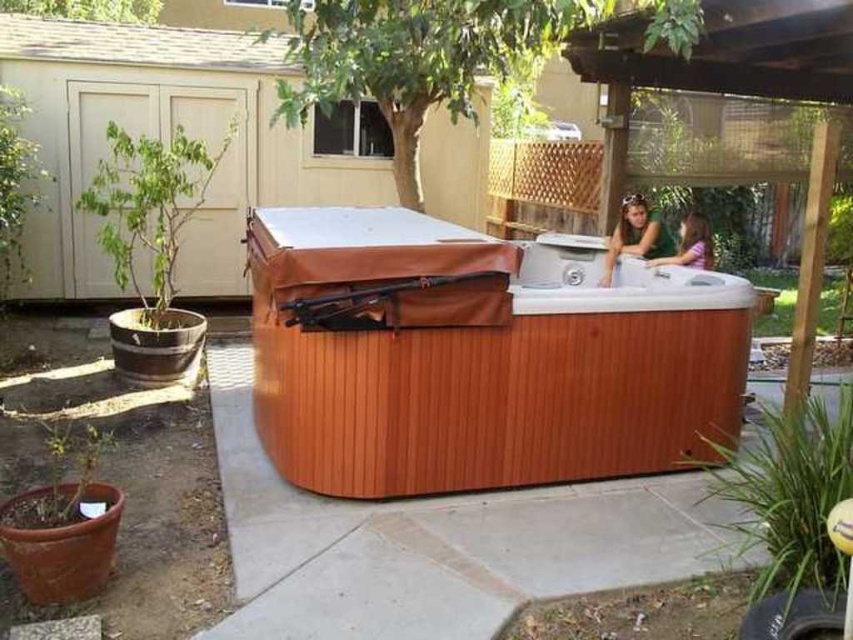
Question: Considering the relative positions of wooden hot tub at center and matte brown hair at upper right in the image provided, where is wooden hot tub at center located with respect to matte brown hair at upper right?

Choices:
 (A) left
 (B) right

Answer: (A)

Question: Which object is positioned closest to the wooden hot tub at center?

Choices:
 (A) matte brown hot tub at upper right
 (B) matte brown hair at upper right

Answer: (B)

Question: Is matte brown hair at upper right to the left of matte brown hot tub at upper right from the viewer's perspective?

Choices:
 (A) yes
 (B) no

Answer: (A)

Question: Estimate the real-world distances between objects in this image. Which object is farther from the matte brown hot tub at upper right?

Choices:
 (A) wooden hot tub at center
 (B) matte brown hair at upper right

Answer: (A)

Question: Which of the following is the farthest from the observer?

Choices:
 (A) matte brown hot tub at upper right
 (B) wooden hot tub at center

Answer: (A)

Question: Is wooden hot tub at center above matte brown hot tub at upper right?

Choices:
 (A) yes
 (B) no

Answer: (B)